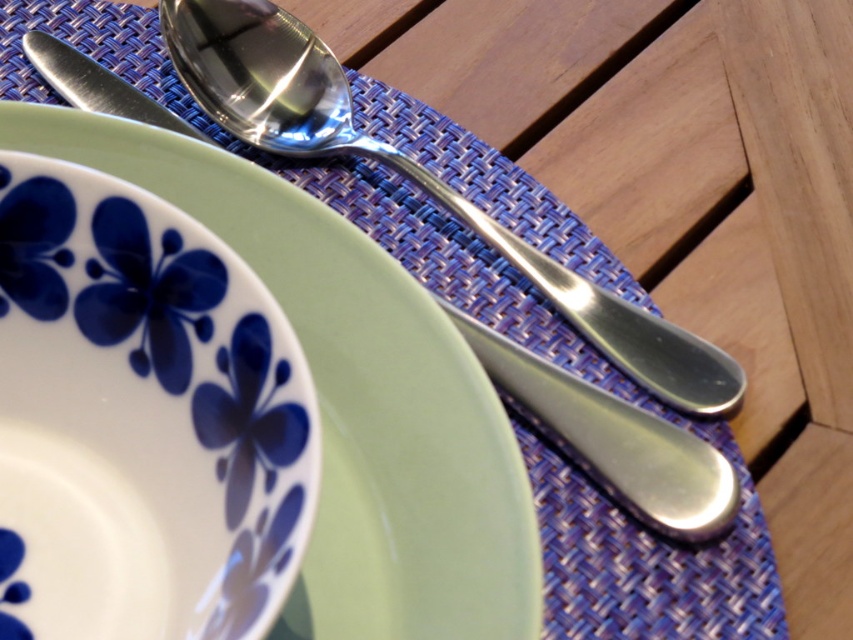
Does green ceramic plate at upper left have a lesser width compared to polished metal spoon at upper center?

Yes.

Is green ceramic plate at upper left below polished metal spoon at upper center?

Yes, green ceramic plate at upper left is below polished metal spoon at upper center.

The width and height of the screenshot is (853, 640). What do you see at coordinates (355, 396) in the screenshot? I see `green ceramic plate at upper left` at bounding box center [355, 396].

This screenshot has height=640, width=853. I want to click on green ceramic plate at upper left, so click(x=355, y=396).